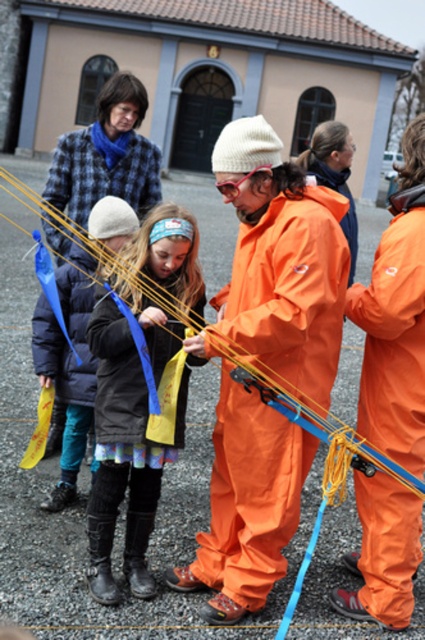
Question: Considering the real-world distances, which object is closest to the fluffy woolen hat at center?

Choices:
 (A) orange waterproof suit at center
 (B) orange waterproof jumpsuit at center

Answer: (B)

Question: Which of these objects is positioned closest to the orange waterproof jumpsuit at center?

Choices:
 (A) orange waterproof suit at center
 (B) fluffy woolen hat at center

Answer: (B)

Question: Does fluffy woolen hat at center appear on the right side of orange waterproof suit at center?

Choices:
 (A) yes
 (B) no

Answer: (A)

Question: Can you confirm if orange waterproof jumpsuit at center is positioned below fluffy woolen hat at center?

Choices:
 (A) no
 (B) yes

Answer: (A)

Question: Is fluffy woolen hat at center above orange waterproof suit at center?

Choices:
 (A) yes
 (B) no

Answer: (B)

Question: Among these objects, which one is farthest from the camera?

Choices:
 (A) orange waterproof jumpsuit at center
 (B) fluffy woolen hat at center
 (C) orange waterproof suit at center

Answer: (C)